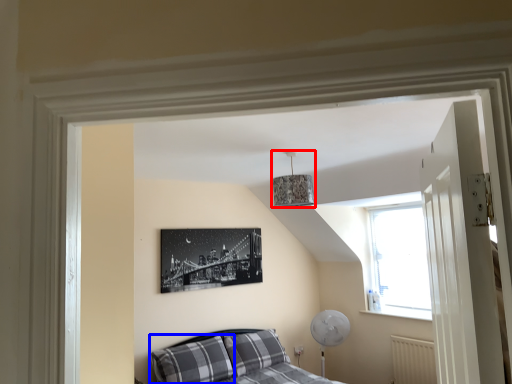
Question: Which point is closer to the camera, lamp (highlighted by a red box) or pillow (highlighted by a blue box)?

Choices:
 (A) lamp
 (B) pillow

Answer: (A)